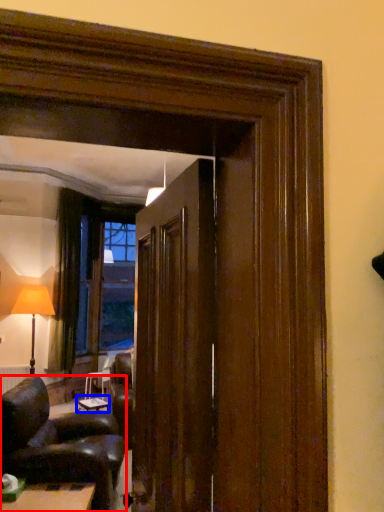
Question: Among these objects, which one is farthest to the camera, chair (highlighted by a red box) or table (highlighted by a blue box)?

Choices:
 (A) chair
 (B) table

Answer: (B)